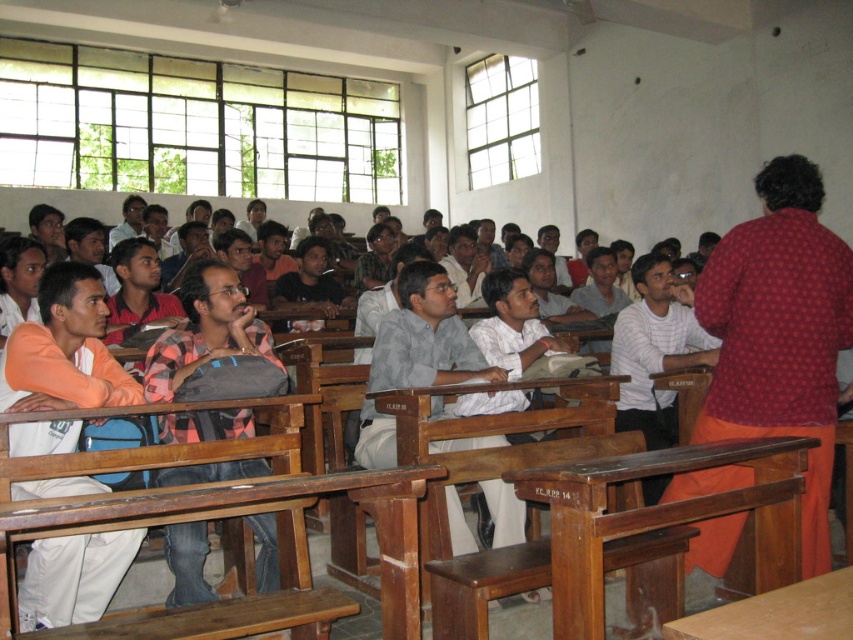
Question: Is brown wooden table at center bigger than brown wood table at lower left?

Choices:
 (A) no
 (B) yes

Answer: (A)

Question: Is brown wooden table at center closer to camera compared to brown wood table at lower left?

Choices:
 (A) yes
 (B) no

Answer: (B)

Question: Which point appears farthest from the camera in this image?

Choices:
 (A) (601, 564)
 (B) (758, 188)
 (C) (199, 488)

Answer: (B)

Question: Is brown wooden table at center positioned behind brown wood table at lower left?

Choices:
 (A) no
 (B) yes

Answer: (B)

Question: Among these objects, which one is nearest to the camera?

Choices:
 (A) brown wooden table at center
 (B) brown wood table at lower left
 (C) red dotted shirt at upper right

Answer: (B)

Question: Estimate the real-world distances between objects in this image. Which object is farther from the brown wood table at lower left?

Choices:
 (A) brown wooden table at center
 (B) wooden table at center
 (C) red dotted shirt at upper right

Answer: (C)